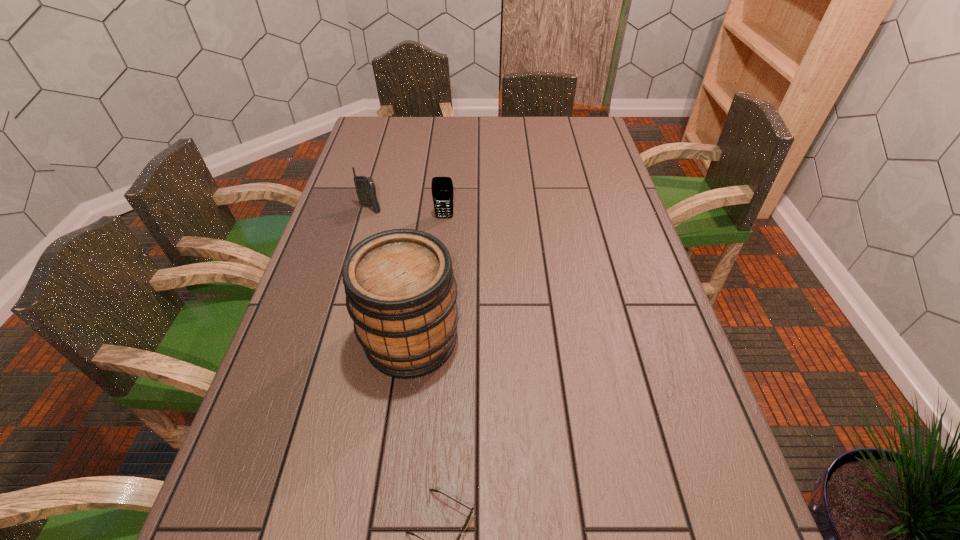
Find the location of a particular element. the tallest object is located at coordinates (401, 292).

In order to click on cider in this screenshot , I will do `click(401, 292)`.

This screenshot has width=960, height=540. Identify the location of the farther cellular telephone. (365, 187).

At what (x,y) coordinates should I click in order to perform the action: click on the left cellular telephone. Please return your answer as a coordinate pair (x, y). This screenshot has height=540, width=960. Looking at the image, I should click on (365, 187).

The width and height of the screenshot is (960, 540). What are the coordinates of `the second farthest object` in the screenshot? It's located at (442, 187).

Where is `the nearer cellular telephone`? the nearer cellular telephone is located at coordinates (442, 187).

Where is `vacant space situated on the front of the tallest object`? The height and width of the screenshot is (540, 960). vacant space situated on the front of the tallest object is located at coordinates (400, 418).

Where is `vacant space located on the keyboard of the farthest object`? The image size is (960, 540). vacant space located on the keyboard of the farthest object is located at coordinates (345, 303).

Locate an element on the screen. vacant space situated on the screen of the right cellular telephone is located at coordinates (438, 288).

Locate an element on the screen. The height and width of the screenshot is (540, 960). object positioned at the left edge is located at coordinates (365, 187).